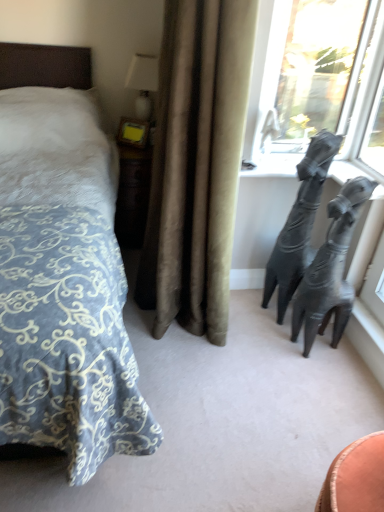
Where is `free spot in front of black matte giraffe at right`? free spot in front of black matte giraffe at right is located at coordinates (273, 342).